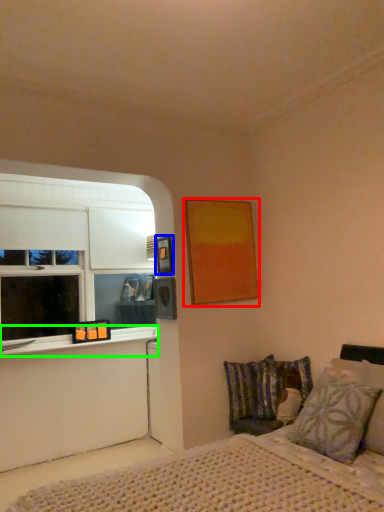
Question: Which object is the farthest from picture frame (highlighted by a red box)? Choose among these: picture frame (highlighted by a blue box) or window sill (highlighted by a green box).

Choices:
 (A) picture frame
 (B) window sill

Answer: (B)